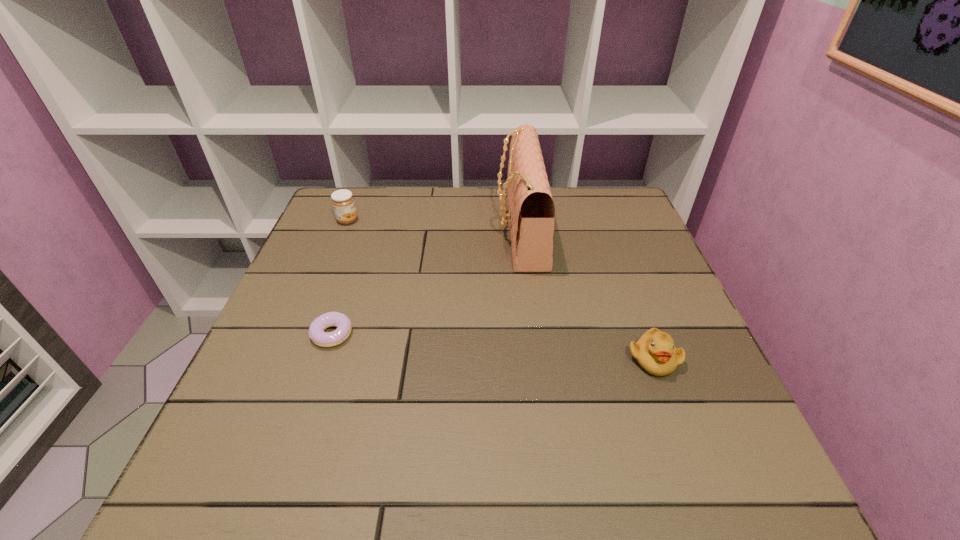
Find the location of `vacant space at the far left corner`. vacant space at the far left corner is located at coordinates (334, 225).

The height and width of the screenshot is (540, 960). I want to click on vacant space at the near left corner, so click(219, 460).

Find the location of a particular element. free space at the far right corner is located at coordinates (585, 200).

Locate an element on the screen. empty space that is in between the duckling and the doughnut is located at coordinates (492, 347).

Image resolution: width=960 pixels, height=540 pixels. Identify the location of vacant point located between the handbag and the jam. (434, 225).

What are the coordinates of `vacant area between the jam and the duckling` in the screenshot? It's located at (500, 290).

This screenshot has width=960, height=540. In order to click on empty space between the doughnut and the jam in this screenshot , I will do `click(340, 278)`.

At what (x,y) coordinates should I click in order to perform the action: click on free spot between the duckling and the shortest object. Please return your answer as a coordinate pair (x, y). This screenshot has width=960, height=540. Looking at the image, I should click on (492, 347).

The height and width of the screenshot is (540, 960). I want to click on vacant area between the duckling and the jam, so click(x=500, y=290).

The width and height of the screenshot is (960, 540). I want to click on unoccupied position between the rightmost object and the third object from left to right, so (x=587, y=295).